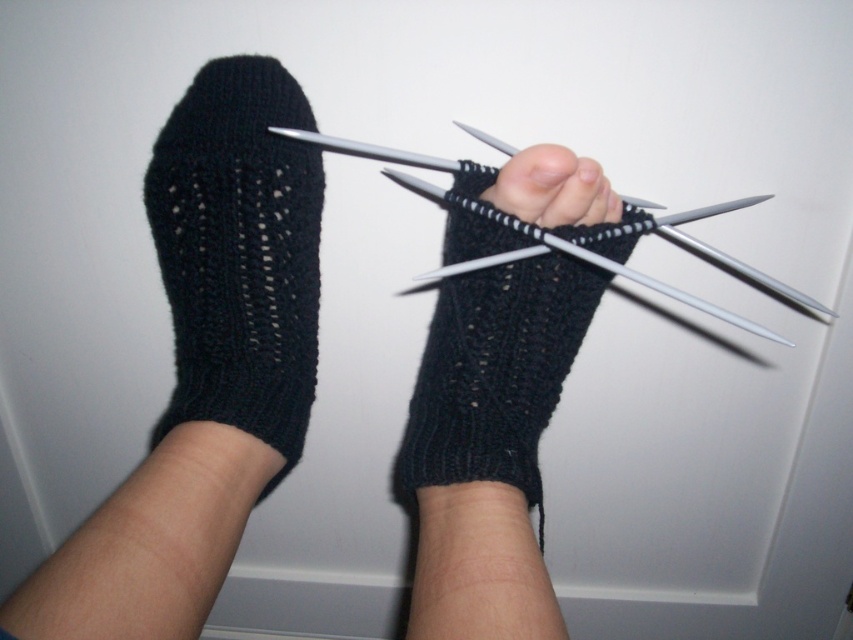
Does point (302, 221) lie in front of point (541, 189)?

That is False.

Is point (416, 403) more distant than point (537, 218)?

Yes, point (416, 403) is farther from viewer.

Identify the location of black knitted socks at center. This screenshot has width=853, height=640. (206, 365).

Who is taller, metallic silver knitting needles at center or matte black sock at center?

metallic silver knitting needles at center is taller.

Who is positioned more to the left, metallic silver knitting needles at center or matte black sock at center?

matte black sock at center

At what (x,y) coordinates should I click in order to perform the action: click on metallic silver knitting needles at center. Please return your answer as a coordinate pair (x, y). The height and width of the screenshot is (640, 853). Looking at the image, I should click on (610, 259).

Does point (195, 129) come closer to viewer compared to point (581, 161)?

No, it is behind (581, 161).

Does point (187, 376) lie behind point (566, 172)?

Yes, it is behind point (566, 172).

The height and width of the screenshot is (640, 853). What do you see at coordinates (239, 252) in the screenshot?
I see `black knitted sock at left` at bounding box center [239, 252].

The width and height of the screenshot is (853, 640). In order to click on black knitted sock at left in this screenshot , I will do `click(239, 252)`.